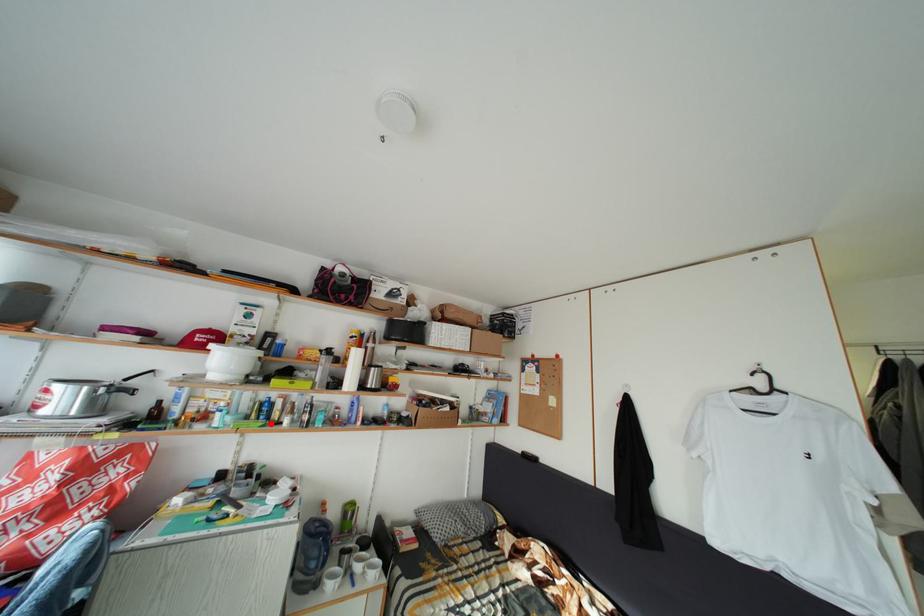
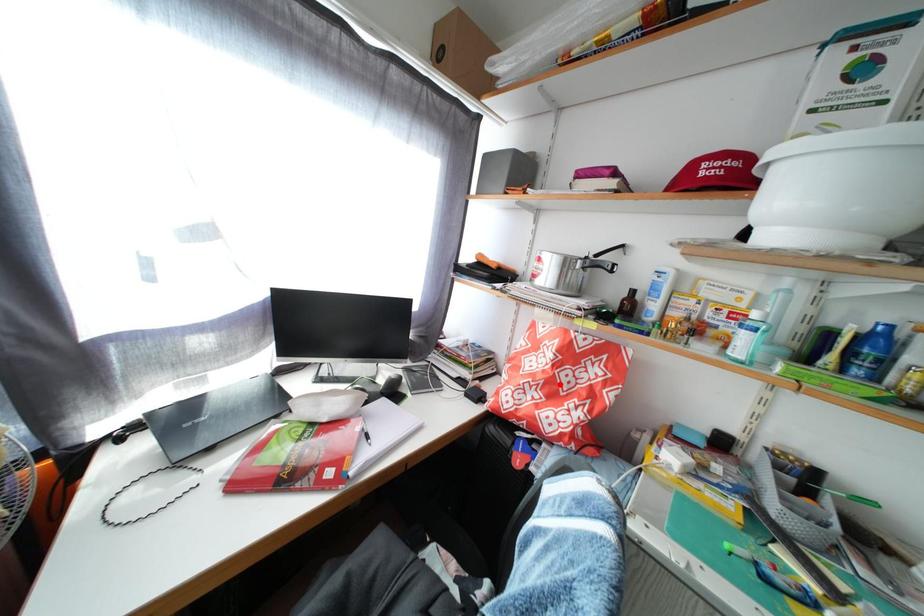
I am providing you with two images of the same scene from different viewpoints. A red point is marked on the first image and another point is marked on the second image. Is the marked point in image1 the same physical position as the marked point in image2?

No